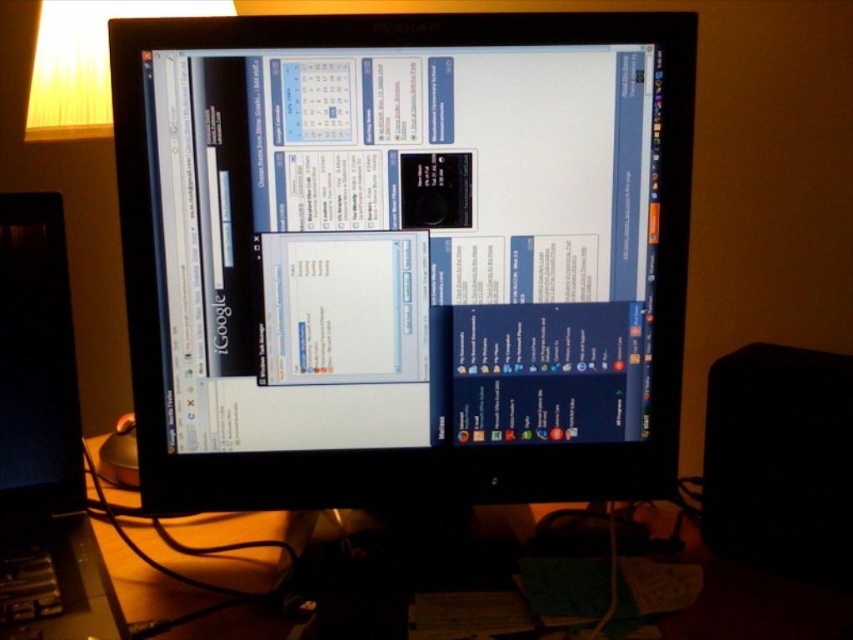
Is white glossy monitor at center positioned before black glossy monitor at center?

No, it is not.

Is point (479, 269) positioned after point (76, 444)?

No, (479, 269) is in front of (76, 444).

Is point (260, 161) positioned before point (27, 552)?

Yes, it is.

At what (x,y) coordinates should I click in order to perform the action: click on white glossy monitor at center. Please return your answer as a coordinate pair (x, y). Looking at the image, I should click on (376, 221).